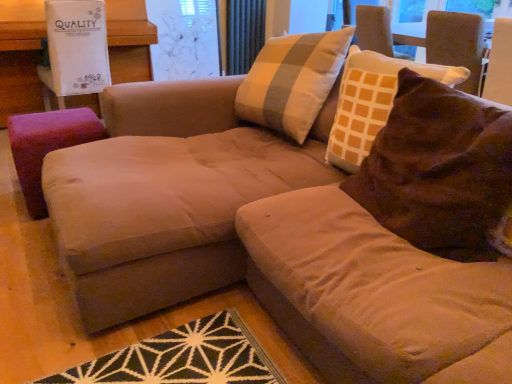
Question: Considering the positions of point (381, 281) and point (399, 196), is point (381, 281) closer or farther from the camera than point (399, 196)?

Choices:
 (A) farther
 (B) closer

Answer: (B)

Question: In terms of size, does suede beige couch at center appear bigger or smaller than brown velvety throw pillow at upper right?

Choices:
 (A) big
 (B) small

Answer: (A)

Question: Which object is positioned farthest from the brown velvety throw pillow at upper right?

Choices:
 (A) transparent plastic screen at upper center
 (B) suede beige couch at center
 (C) dark gray metallic radiator at upper center
 (D) pink fabric ottoman at left
 (E) purple fabric stool at left

Answer: (C)

Question: Considering the real-world distances, which object is closest to the transparent plastic screen at upper center?

Choices:
 (A) brown velvety throw pillow at upper right
 (B) suede beige couch at center
 (C) purple fabric stool at left
 (D) pink fabric ottoman at left
 (E) dark gray metallic radiator at upper center

Answer: (E)